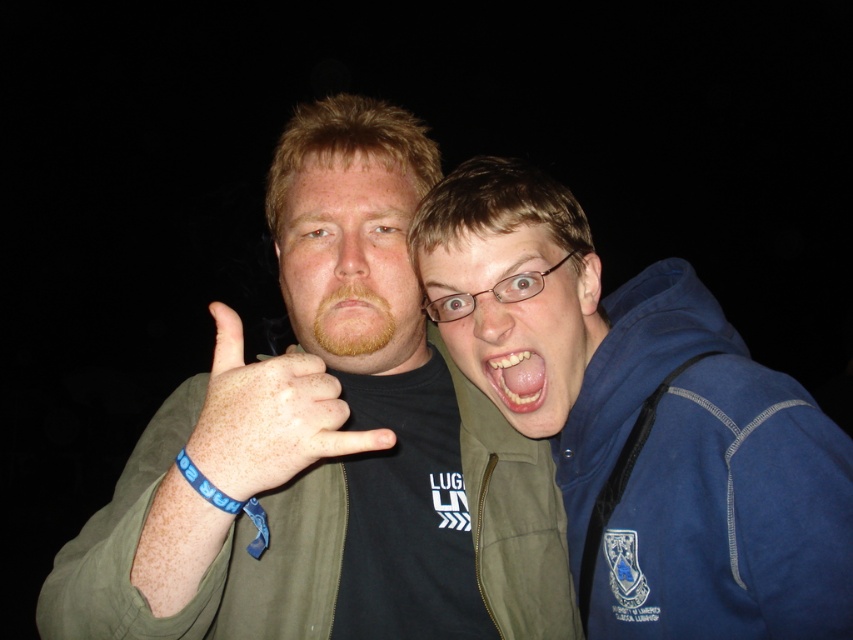
Question: Which of the following is the closest to the observer?

Choices:
 (A) (421, 336)
 (B) (492, 381)
 (C) (418, 520)
 (D) (431, 310)

Answer: (B)

Question: Which object appears closest to the camera in this image?

Choices:
 (A) blue fleece jacket at right
 (B) white glossy teeth at center
 (C) matte green face at center

Answer: (A)

Question: Does light brown hair at center appear on the right side of matte green face at center?

Choices:
 (A) yes
 (B) no

Answer: (B)

Question: Which of the following is the farthest from the observer?

Choices:
 (A) (428, 221)
 (B) (126, 608)

Answer: (A)

Question: Is blue rubber band at center to the right of white glossy teeth at center from the viewer's perspective?

Choices:
 (A) yes
 (B) no

Answer: (B)

Question: Is green matte jacket at center wider than blue fleece jacket at right?

Choices:
 (A) yes
 (B) no

Answer: (A)